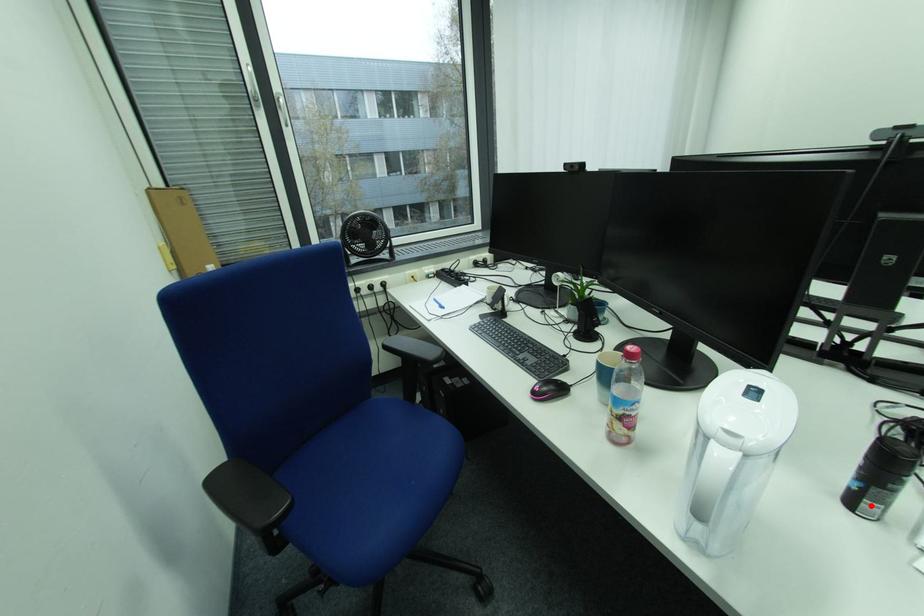
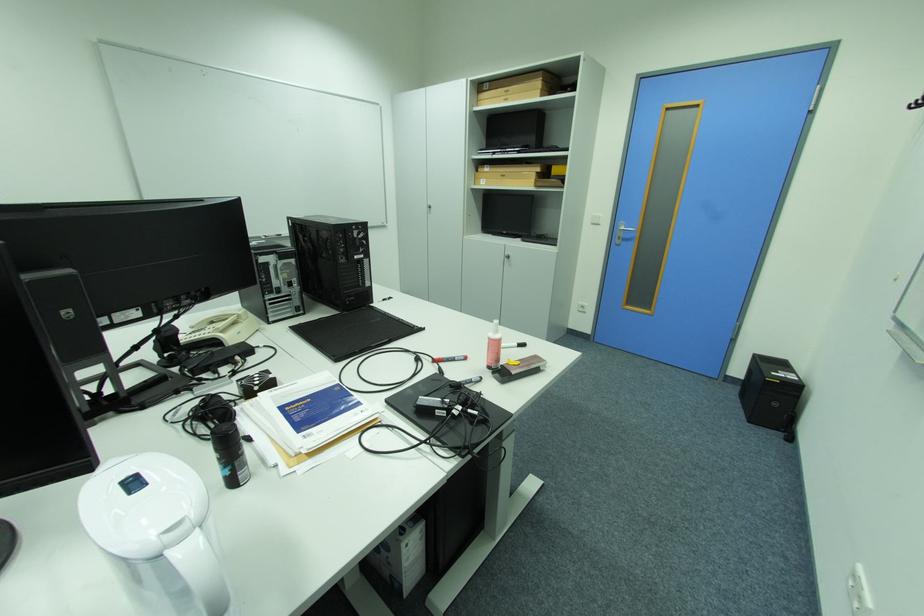
Find the pixel in the second image that matches the highlighted location in the first image.

(247, 477)